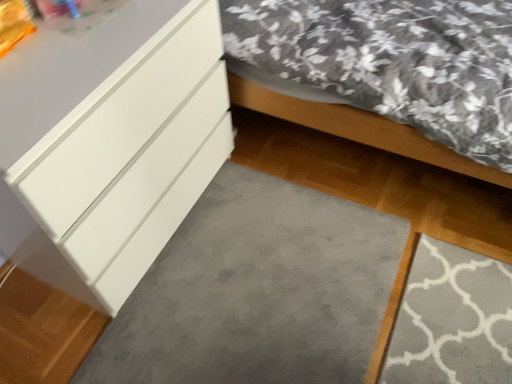
Question: Can you see matte white bed at lower left touching gray soft carpet at lower center?

Choices:
 (A) no
 (B) yes

Answer: (A)

Question: Is matte white bed at lower left far from gray soft carpet at lower center?

Choices:
 (A) yes
 (B) no

Answer: (B)

Question: Can gray soft carpet at lower center be found inside matte white bed at lower left?

Choices:
 (A) no
 (B) yes

Answer: (A)

Question: From a real-world perspective, is matte white bed at lower left physically above gray soft carpet at lower center?

Choices:
 (A) no
 (B) yes

Answer: (B)

Question: Does matte white bed at lower left come behind gray soft carpet at lower center?

Choices:
 (A) yes
 (B) no

Answer: (B)

Question: Based on their sizes in the image, would you say matte white bed at lower left is bigger or smaller than gray soft carpet at lower center?

Choices:
 (A) big
 (B) small

Answer: (A)

Question: Is matte white bed at lower left taller or shorter than gray soft carpet at lower center?

Choices:
 (A) tall
 (B) short

Answer: (A)

Question: Considering their positions, is matte white bed at lower left located in front of or behind gray soft carpet at lower center?

Choices:
 (A) front
 (B) behind

Answer: (A)

Question: Is matte white bed at lower left inside the boundaries of gray soft carpet at lower center, or outside?

Choices:
 (A) outside
 (B) inside

Answer: (A)

Question: Considering the relative positions of white glossy chest of drawers at left and matte white bed at lower left in the image provided, is white glossy chest of drawers at left to the left or to the right of matte white bed at lower left?

Choices:
 (A) left
 (B) right

Answer: (A)

Question: From their relative heights in the image, would you say white glossy chest of drawers at left is taller or shorter than matte white bed at lower left?

Choices:
 (A) tall
 (B) short

Answer: (B)

Question: Considering the positions of white glossy chest of drawers at left and matte white bed at lower left in the image, is white glossy chest of drawers at left wider or thinner than matte white bed at lower left?

Choices:
 (A) wide
 (B) thin

Answer: (B)

Question: In the image, is white glossy chest of drawers at left positioned in front of or behind matte white bed at lower left?

Choices:
 (A) front
 (B) behind

Answer: (A)

Question: Is gray soft carpet at lower center bigger or smaller than matte white bed at lower left?

Choices:
 (A) big
 (B) small

Answer: (B)

Question: From a real-world perspective, is gray soft carpet at lower center physically located above or below matte white bed at lower left?

Choices:
 (A) below
 (B) above

Answer: (A)